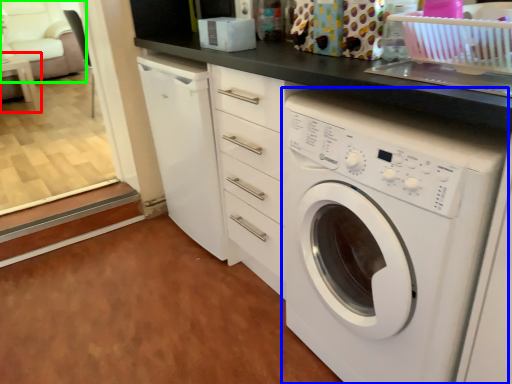
Question: Which is nearer to the table (highlighted by a red box)? washing machine (highlighted by a blue box) or armchair (highlighted by a green box).

Choices:
 (A) washing machine
 (B) armchair

Answer: (B)